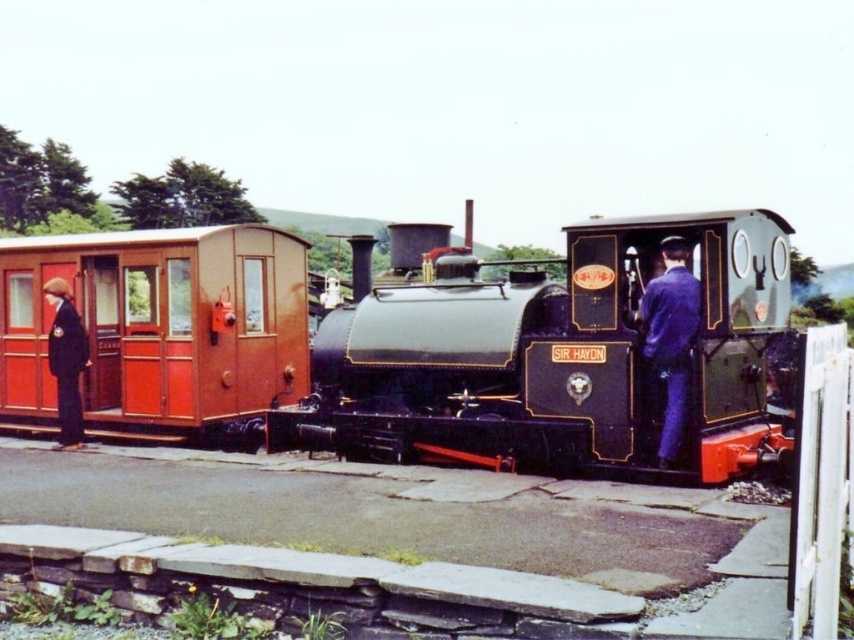
Question: Among these points, which one is farthest from the camera?

Choices:
 (A) 683,353
 (B) 68,284
 (C) 215,262
 (D) 88,388

Answer: (D)

Question: In this image, where is polished black locomotive at center located relative to matte red train car at left?

Choices:
 (A) left
 (B) right

Answer: (B)

Question: Is matte red train car at left bigger than dark blue uniform at left?

Choices:
 (A) no
 (B) yes

Answer: (A)

Question: Which object is farther from the camera taking this photo?

Choices:
 (A) polished black locomotive at center
 (B) dark blue uniform at left
 (C) matte red train car at left

Answer: (C)

Question: In this image, where is matte red train car at left located relative to dark blue uniform at left?

Choices:
 (A) left
 (B) right

Answer: (A)

Question: Among these objects, which one is farthest from the camera?

Choices:
 (A) dark blue uniform at left
 (B) polished black locomotive at center

Answer: (A)